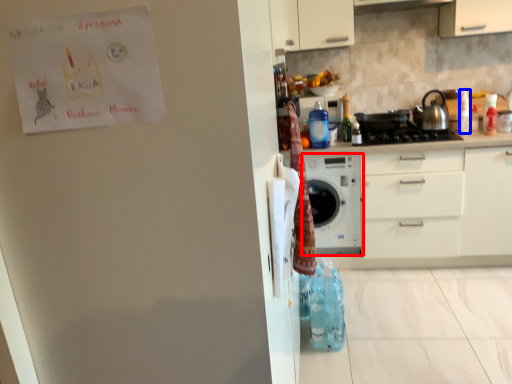
Question: Which of the following is the closest to the observer, home appliance (highlighted by a red box) or bottle (highlighted by a blue box)?

Choices:
 (A) home appliance
 (B) bottle

Answer: (A)